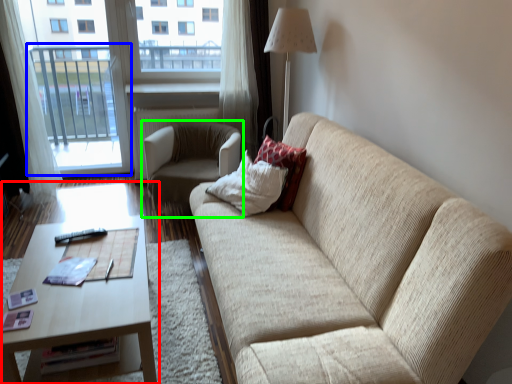
Question: Which is nearer to the coffee table (highlighted by a red box)? screen door (highlighted by a blue box) or chair (highlighted by a green box).

Choices:
 (A) screen door
 (B) chair

Answer: (B)